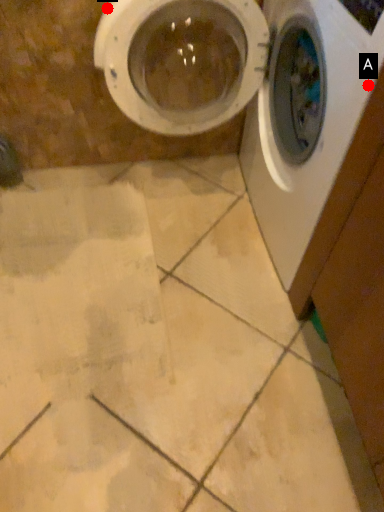
Question: Two points are circled on the image, labeled by A and B beside each circle. Which point is farther from the camera taking this photo?

Choices:
 (A) A is further
 (B) B is further

Answer: (B)